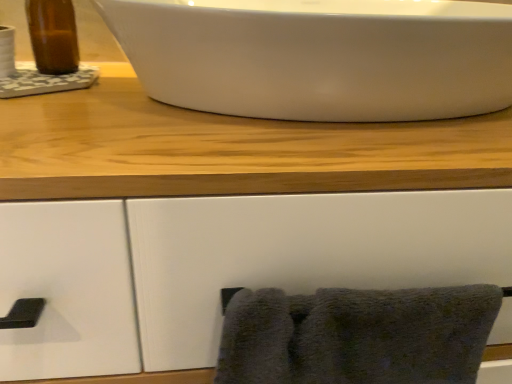
Question: Would you say brown glass bottle at upper left, the 1th sink when ordered from left to right, is outside dark gray fluffy towel at lower right?

Choices:
 (A) yes
 (B) no

Answer: (A)

Question: Is brown glass bottle at upper left, the second sink in the right-to-left sequence, next to dark gray fluffy towel at lower right?

Choices:
 (A) yes
 (B) no

Answer: (B)

Question: Can you confirm if brown glass bottle at upper left, the second sink in the right-to-left sequence, is bigger than dark gray fluffy towel at lower right?

Choices:
 (A) yes
 (B) no

Answer: (B)

Question: Is brown glass bottle at upper left, the 1th sink when ordered from left to right, shorter than dark gray fluffy towel at lower right?

Choices:
 (A) no
 (B) yes

Answer: (A)

Question: Is brown glass bottle at upper left, the second sink in the right-to-left sequence, facing away from dark gray fluffy towel at lower right?

Choices:
 (A) yes
 (B) no

Answer: (B)

Question: Considering the positions of point (424, 4) and point (8, 87), is point (424, 4) closer or farther from the camera than point (8, 87)?

Choices:
 (A) closer
 (B) farther

Answer: (A)

Question: Considering the positions of white glossy sink at upper center, acting as the 2th sink starting from the left, and brown glass bottle at upper left, the 1th sink when ordered from left to right, in the image, is white glossy sink at upper center, acting as the 2th sink starting from the left, bigger or smaller than brown glass bottle at upper left, the 1th sink when ordered from left to right,?

Choices:
 (A) small
 (B) big

Answer: (B)

Question: Is white glossy sink at upper center, the 1th sink when ordered from right to left, inside the boundaries of brown glass bottle at upper left, the second sink in the right-to-left sequence, or outside?

Choices:
 (A) outside
 (B) inside

Answer: (A)

Question: From a real-world perspective, relative to brown glass bottle at upper left, the second sink in the right-to-left sequence, is white glossy sink at upper center, the 1th sink when ordered from right to left, vertically above or below?

Choices:
 (A) below
 (B) above

Answer: (A)

Question: Is dark gray fluffy towel at lower right inside or outside of white glossy sink at upper center, the 1th sink when ordered from right to left?

Choices:
 (A) outside
 (B) inside

Answer: (A)

Question: In the image, is dark gray fluffy towel at lower right positioned in front of or behind white glossy sink at upper center, the 1th sink when ordered from right to left?

Choices:
 (A) behind
 (B) front

Answer: (A)

Question: Considering the positions of dark gray fluffy towel at lower right and white glossy sink at upper center, the 1th sink when ordered from right to left, in the image, is dark gray fluffy towel at lower right taller or shorter than white glossy sink at upper center, the 1th sink when ordered from right to left,?

Choices:
 (A) short
 (B) tall

Answer: (B)

Question: Would you say dark gray fluffy towel at lower right is to the left or to the right of white glossy sink at upper center, the 1th sink when ordered from right to left, in the picture?

Choices:
 (A) right
 (B) left

Answer: (B)

Question: Visually, is white glossy sink at upper center, the 1th sink when ordered from right to left, positioned to the left or to the right of dark gray fluffy towel at lower right?

Choices:
 (A) left
 (B) right

Answer: (B)

Question: Is white glossy sink at upper center, acting as the 2th sink starting from the left, bigger or smaller than dark gray fluffy towel at lower right?

Choices:
 (A) small
 (B) big

Answer: (B)